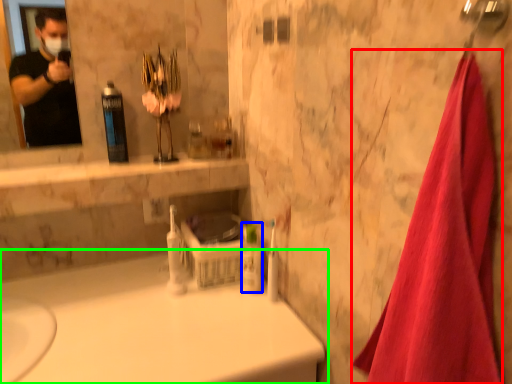
Question: Considering the real-world distances, which object is farthest from bath towel (highlighted by a red box)? mouthwash (highlighted by a blue box) or bathtub (highlighted by a green box)?

Choices:
 (A) mouthwash
 (B) bathtub

Answer: (A)